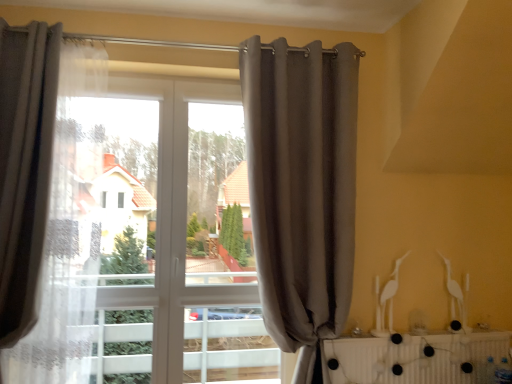
Image resolution: width=512 pixels, height=384 pixels. What do you see at coordinates (302, 189) in the screenshot?
I see `gray fabric curtain at center, positioned as the first curtain in right-to-left order` at bounding box center [302, 189].

This screenshot has width=512, height=384. Identify the location of matte gray curtain at left, which ranks as the 2th curtain in right-to-left order. (37, 195).

Would you consider gray fabric curtain at center, which is the second curtain in left-to-right order, to be distant from matte gray curtain at left, placed as the first curtain when sorted from left to right?

Absolutely, gray fabric curtain at center, which is the second curtain in left-to-right order, is distant from matte gray curtain at left, placed as the first curtain when sorted from left to right.

Is gray fabric curtain at center, which is the second curtain in left-to-right order, outside of matte gray curtain at left, placed as the first curtain when sorted from left to right?

gray fabric curtain at center, which is the second curtain in left-to-right order, is positioned outside matte gray curtain at left, placed as the first curtain when sorted from left to right.

From a real-world perspective, which is physically below, gray fabric curtain at center, which is the second curtain in left-to-right order, or matte gray curtain at left, placed as the first curtain when sorted from left to right?

matte gray curtain at left, placed as the first curtain when sorted from left to right, is physically lower.

Between gray fabric curtain at center, positioned as the first curtain in right-to-left order, and matte gray curtain at left, placed as the first curtain when sorted from left to right, which one is positioned in front?

matte gray curtain at left, placed as the first curtain when sorted from left to right, is closer to the camera.

You are a GUI agent. You are given a task and a screenshot of the screen. Output one action in this format:
    pyautogui.click(x=<x>, y=<y>)
    Task: Click on the curtain located above the matte gray curtain at left, placed as the first curtain when sorted from left to right (from a real-world perspective)
    The width and height of the screenshot is (512, 384).
    Given the screenshot: What is the action you would take?
    pyautogui.click(x=302, y=189)

Is matte gray curtain at left, which ranks as the 2th curtain in right-to-left order, positioned far away from gray fabric curtain at center, which is the second curtain in left-to-right order?

matte gray curtain at left, which ranks as the 2th curtain in right-to-left order, is positioned a significant distance from gray fabric curtain at center, which is the second curtain in left-to-right order.

From the image's perspective, is matte gray curtain at left, which ranks as the 2th curtain in right-to-left order, located above or below gray fabric curtain at center, which is the second curtain in left-to-right order?

Clearly, from the image's perspective, matte gray curtain at left, which ranks as the 2th curtain in right-to-left order, is below gray fabric curtain at center, which is the second curtain in left-to-right order.

Could gray fabric curtain at center, positioned as the first curtain in right-to-left order, be considered to be inside matte gray curtain at left, which ranks as the 2th curtain in right-to-left order?

No, gray fabric curtain at center, positioned as the first curtain in right-to-left order, is located outside of matte gray curtain at left, which ranks as the 2th curtain in right-to-left order.

Relative to white plastic radiator at lower right, is matte gray curtain at left, placed as the first curtain when sorted from left to right, in front or behind?

matte gray curtain at left, placed as the first curtain when sorted from left to right, is positioned closer to the viewer than white plastic radiator at lower right.

In terms of height, does matte gray curtain at left, which ranks as the 2th curtain in right-to-left order, look taller or shorter compared to white plastic radiator at lower right?

Considering their sizes, matte gray curtain at left, which ranks as the 2th curtain in right-to-left order, has more height than white plastic radiator at lower right.

Between matte gray curtain at left, placed as the first curtain when sorted from left to right, and white plastic radiator at lower right, which one has larger width?

matte gray curtain at left, placed as the first curtain when sorted from left to right.

Is matte gray curtain at left, placed as the first curtain when sorted from left to right, surrounding white plastic radiator at lower right?

No, white plastic radiator at lower right is located outside of matte gray curtain at left, placed as the first curtain when sorted from left to right.

From the image's perspective, would you say white plastic radiator at lower right is positioned over matte gray curtain at left, which ranks as the 2th curtain in right-to-left order?

No, from the image's perspective, white plastic radiator at lower right is not above matte gray curtain at left, which ranks as the 2th curtain in right-to-left order.

Is white plastic radiator at lower right facing away from matte gray curtain at left, which ranks as the 2th curtain in right-to-left order?

No, white plastic radiator at lower right is not facing away from matte gray curtain at left, which ranks as the 2th curtain in right-to-left order.

Is white plastic radiator at lower right touching matte gray curtain at left, which ranks as the 2th curtain in right-to-left order?

No, white plastic radiator at lower right is not in contact with matte gray curtain at left, which ranks as the 2th curtain in right-to-left order.

Which of these two, white plastic radiator at lower right or matte gray curtain at left, which ranks as the 2th curtain in right-to-left order, is wider?

Wider between the two is matte gray curtain at left, which ranks as the 2th curtain in right-to-left order.

Between white plastic radiator at lower right and gray fabric curtain at center, which is the second curtain in left-to-right order, which one has larger width?

With larger width is gray fabric curtain at center, which is the second curtain in left-to-right order.

Between white plastic radiator at lower right and gray fabric curtain at center, positioned as the first curtain in right-to-left order, which one has more height?

Standing taller between the two is gray fabric curtain at center, positioned as the first curtain in right-to-left order.

Can you confirm if white plastic radiator at lower right is smaller than gray fabric curtain at center, positioned as the first curtain in right-to-left order?

Correct, white plastic radiator at lower right occupies less space than gray fabric curtain at center, positioned as the first curtain in right-to-left order.

Would you say white plastic radiator at lower right is inside or outside gray fabric curtain at center, positioned as the first curtain in right-to-left order?

white plastic radiator at lower right exists outside the volume of gray fabric curtain at center, positioned as the first curtain in right-to-left order.

Considering the positions of point (327, 181) and point (486, 345), is point (327, 181) closer or farther from the camera than point (486, 345)?

Clearly, point (327, 181) is closer to the camera than point (486, 345).

From the image's perspective, which one is positioned higher, gray fabric curtain at center, which is the second curtain in left-to-right order, or white plastic radiator at lower right?

gray fabric curtain at center, which is the second curtain in left-to-right order, from the image's perspective.

Between gray fabric curtain at center, positioned as the first curtain in right-to-left order, and white plastic radiator at lower right, which one has more height?

gray fabric curtain at center, positioned as the first curtain in right-to-left order, is taller.

From a real-world perspective, is gray fabric curtain at center, positioned as the first curtain in right-to-left order, located higher than white plastic radiator at lower right?

Yes, from a real-world perspective, gray fabric curtain at center, positioned as the first curtain in right-to-left order, is on top of white plastic radiator at lower right.

The image size is (512, 384). Find the location of `curtain below the gray fabric curtain at center, which is the second curtain in left-to-right order (from a real-world perspective)`. curtain below the gray fabric curtain at center, which is the second curtain in left-to-right order (from a real-world perspective) is located at coordinates (37, 195).

Where is `curtain below the gray fabric curtain at center, which is the second curtain in left-to-right order (from the image's perspective)`? curtain below the gray fabric curtain at center, which is the second curtain in left-to-right order (from the image's perspective) is located at coordinates (37, 195).

Which object lies further to the anchor point matte gray curtain at left, placed as the first curtain when sorted from left to right, gray fabric curtain at center, positioned as the first curtain in right-to-left order, or white plastic radiator at lower right?

white plastic radiator at lower right is positioned further to the anchor matte gray curtain at left, placed as the first curtain when sorted from left to right.

Looking at the image, which one is located further to gray fabric curtain at center, positioned as the first curtain in right-to-left order, matte gray curtain at left, which ranks as the 2th curtain in right-to-left order, or white plastic radiator at lower right?

Based on the image, matte gray curtain at left, which ranks as the 2th curtain in right-to-left order, appears to be further to gray fabric curtain at center, positioned as the first curtain in right-to-left order.

From the image, which object appears to be nearer to matte gray curtain at left, which ranks as the 2th curtain in right-to-left order, white plastic radiator at lower right or gray fabric curtain at center, positioned as the first curtain in right-to-left order?

gray fabric curtain at center, positioned as the first curtain in right-to-left order, is positioned closer to the anchor matte gray curtain at left, which ranks as the 2th curtain in right-to-left order.

Considering their positions, is matte gray curtain at left, placed as the first curtain when sorted from left to right, positioned closer to white plastic radiator at lower right than gray fabric curtain at center, which is the second curtain in left-to-right order?

gray fabric curtain at center, which is the second curtain in left-to-right order, is closer to white plastic radiator at lower right.

From the image, which object appears to be farther from gray fabric curtain at center, positioned as the first curtain in right-to-left order, white plastic radiator at lower right or matte gray curtain at left, placed as the first curtain when sorted from left to right?

matte gray curtain at left, placed as the first curtain when sorted from left to right, is positioned further to the anchor gray fabric curtain at center, positioned as the first curtain in right-to-left order.

From the image, which object appears to be nearer to white plastic radiator at lower right, gray fabric curtain at center, positioned as the first curtain in right-to-left order, or matte gray curtain at left, placed as the first curtain when sorted from left to right?

gray fabric curtain at center, positioned as the first curtain in right-to-left order, is closer to white plastic radiator at lower right.

The image size is (512, 384). I want to click on curtain between matte gray curtain at left, placed as the first curtain when sorted from left to right, and white plastic radiator at lower right, in the horizontal direction, so click(x=302, y=189).